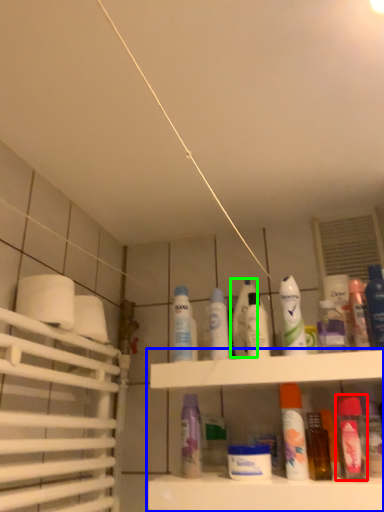
Question: Which object is positioned closest to mouthwash (highlighted by a red box)? Select from shelf (highlighted by a blue box) and toiletry (highlighted by a green box).

Choices:
 (A) shelf
 (B) toiletry

Answer: (A)